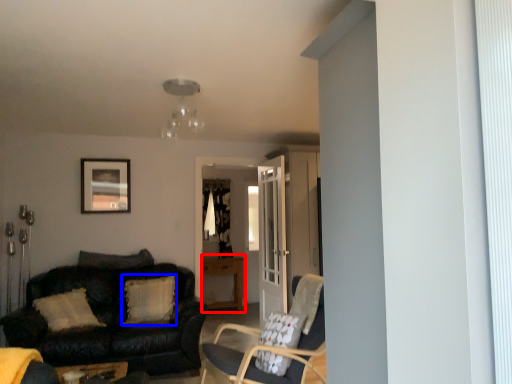
Question: Among these objects, which one is nearest to the camera, table (highlighted by a red box) or pillow (highlighted by a blue box)?

Choices:
 (A) table
 (B) pillow

Answer: (B)